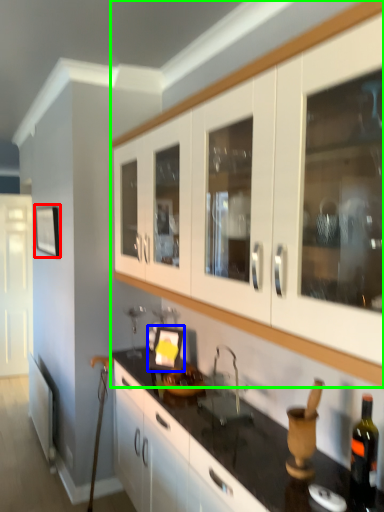
Question: Which object is the closest to the picture frame (highlighted by a red box)? Choose among these: picture frame (highlighted by a blue box) or cabinetry (highlighted by a green box).

Choices:
 (A) picture frame
 (B) cabinetry

Answer: (A)